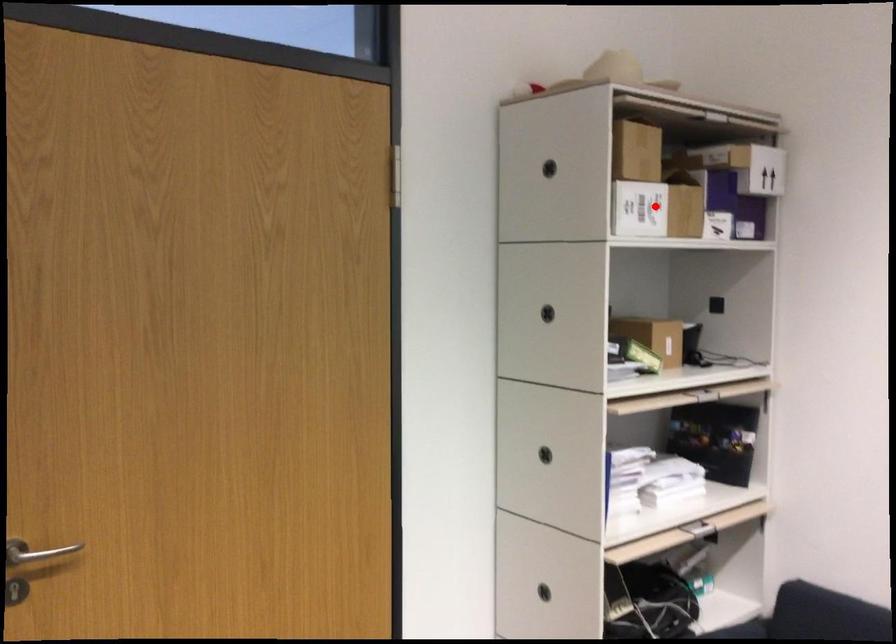
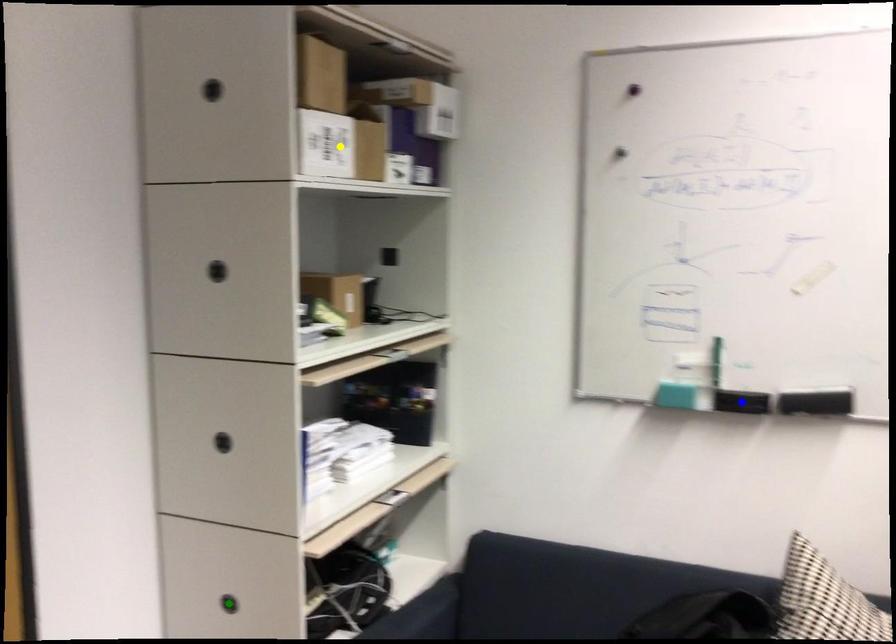
Question: I am providing you with two images of the same scene from different viewpoints. A red point is marked on the first image. You are given multiple points on the second image. In image 2, which mark is for the same physical point as the one in image 1?

Choices:
 (A) blue point
 (B) yellow point
 (C) green point

Answer: (B)